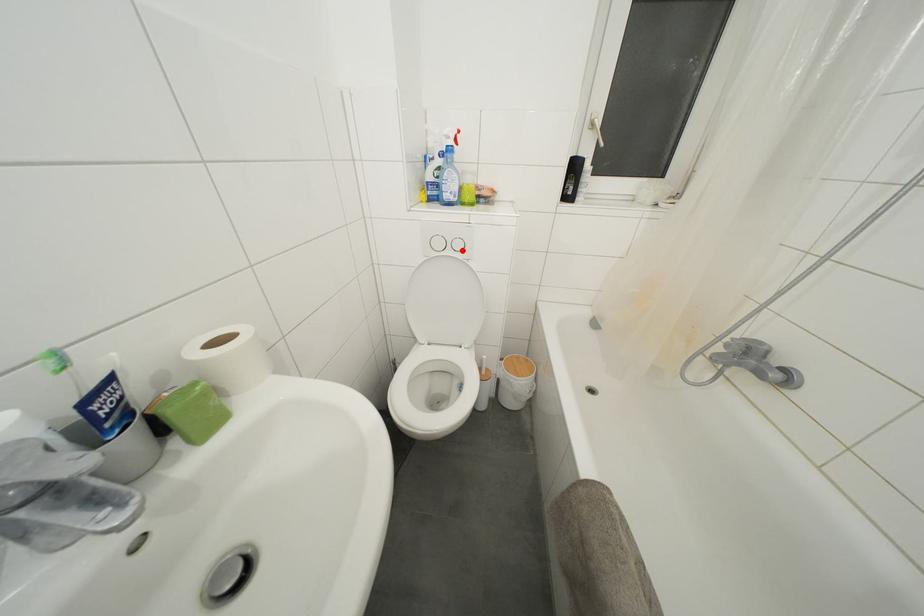
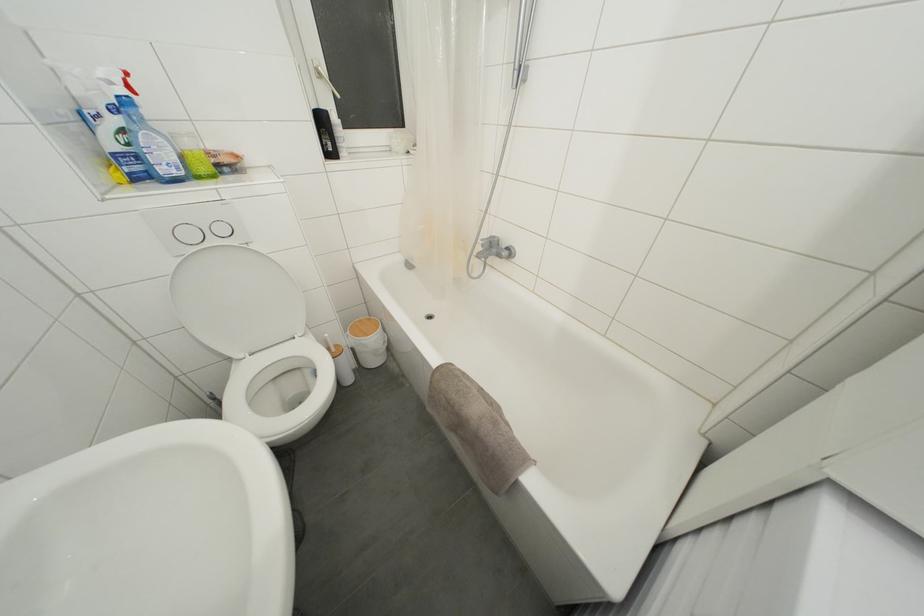
In the second image, find the point that corresponds to the highlighted location in the first image.

(226, 235)